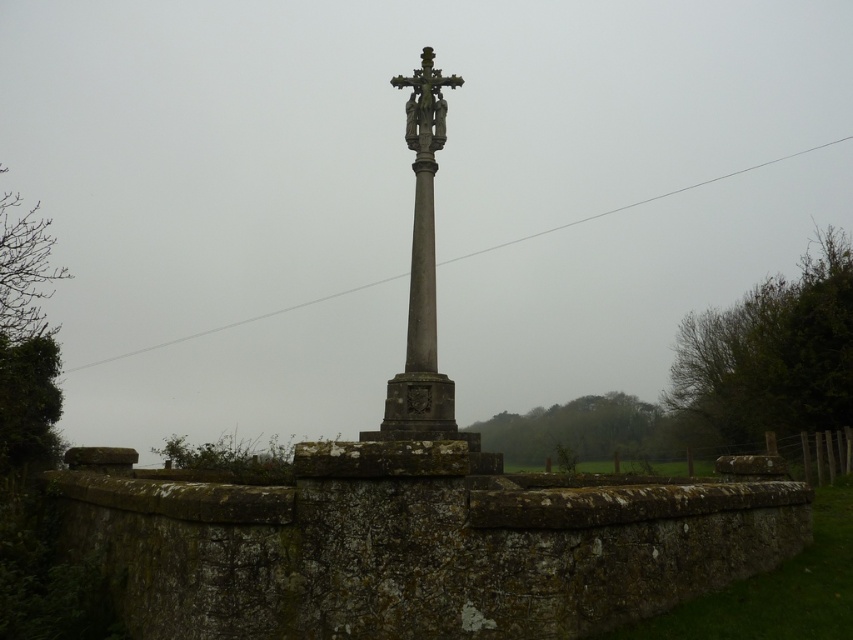
Does gray stone cross at center appear over dark gray stone crucifix at center?

Incorrect, gray stone cross at center is not positioned above dark gray stone crucifix at center.

Find the location of a particular element. This screenshot has width=853, height=640. gray stone cross at center is located at coordinates (422, 276).